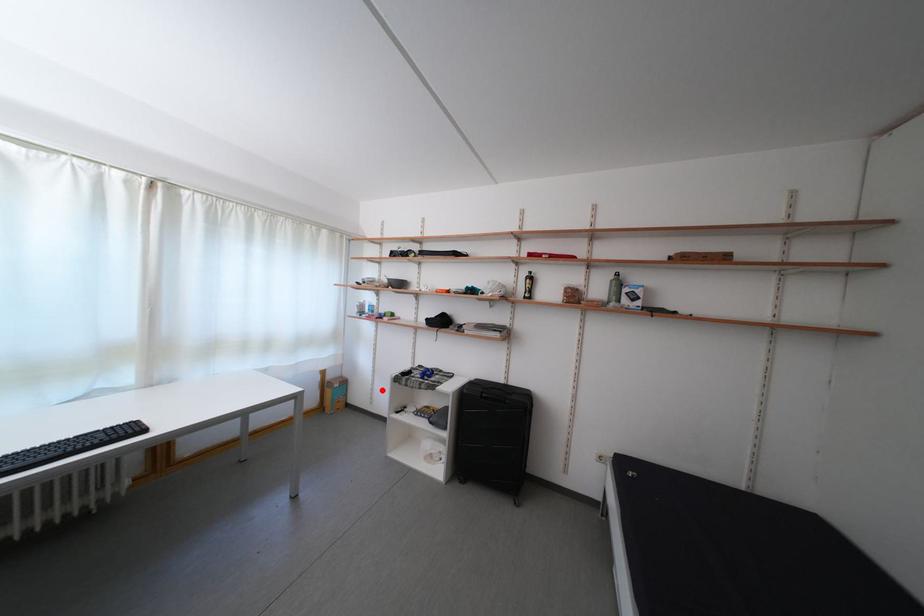
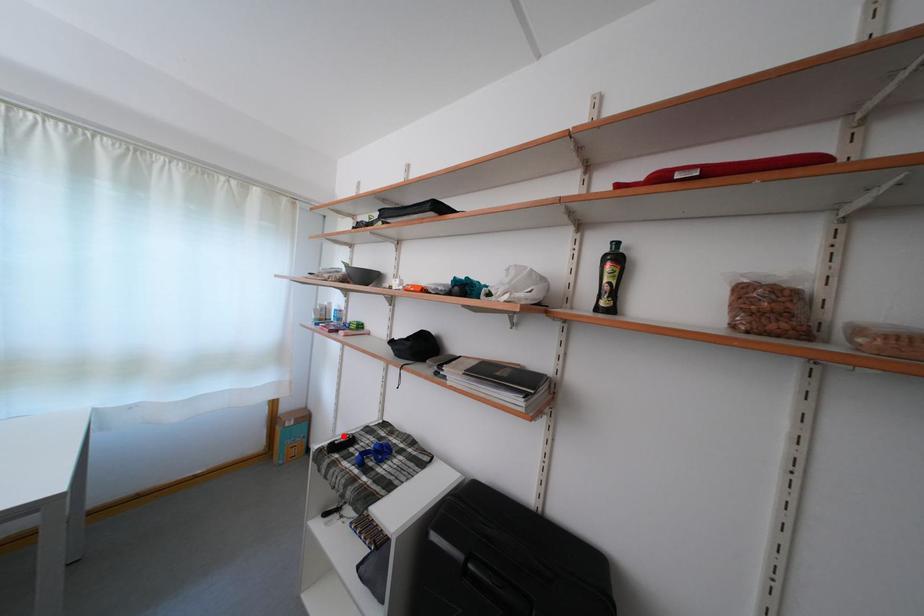
I am providing you with two images of the same scene from different viewpoints. A red point is marked on the first image and another point is marked on the second image. Is the red point in image1 aligned with the point shown in image2?

Yes